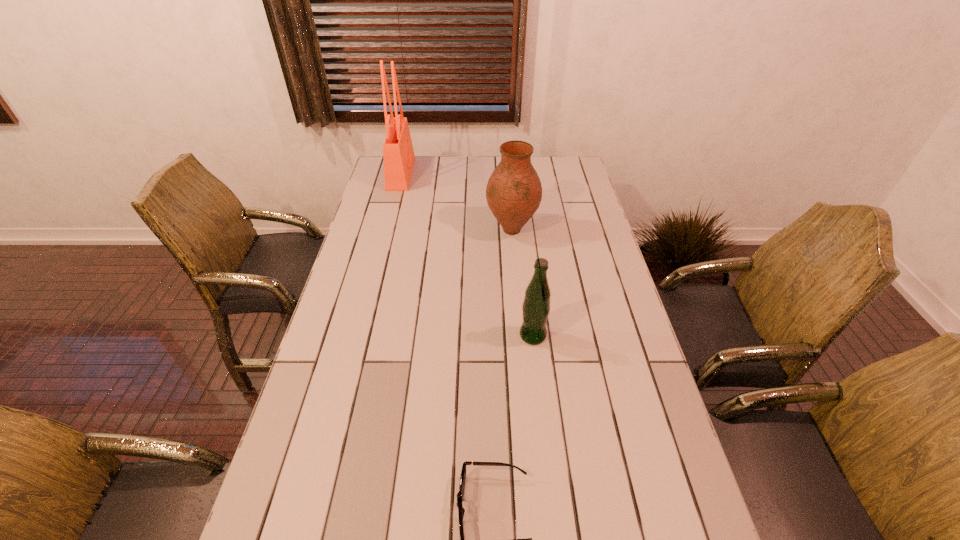
Where is `object that is positioned at the far left corner`? The image size is (960, 540). object that is positioned at the far left corner is located at coordinates (398, 154).

Locate an element on the screen. vacant space at the far edge of the desktop is located at coordinates (540, 171).

Where is `vacant space at the left edge`? vacant space at the left edge is located at coordinates (388, 204).

In the image, there is a desktop. Identify the location of vacant space at the right edge. The image size is (960, 540). (636, 518).

Locate an element on the screen. The image size is (960, 540). free space at the far right corner of the desktop is located at coordinates (548, 174).

This screenshot has width=960, height=540. In order to click on empty space that is in between the second farthest object and the beer bottle in this screenshot , I will do `click(522, 282)`.

Identify the location of vacant region between the tallest object and the vase. This screenshot has height=540, width=960. (456, 202).

Find the location of a particular element. This screenshot has width=960, height=540. vacant region between the beer bottle and the leftmost object is located at coordinates (467, 254).

Locate an element on the screen. The image size is (960, 540). empty location between the vase and the leftmost object is located at coordinates (456, 202).

I want to click on object that is the third closest to the beer bottle, so click(x=398, y=154).